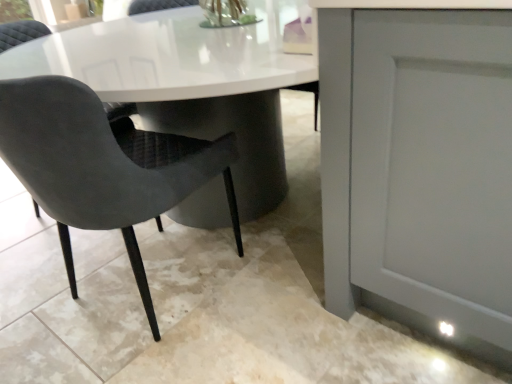
Find the location of a particular element. empty space that is to the right of suede gray chair at lower left is located at coordinates (283, 290).